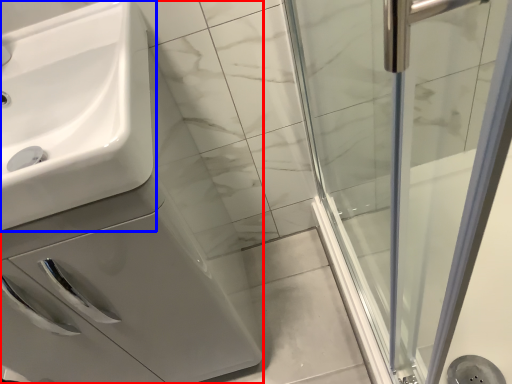
Question: Which of the following is the closest to the observer, porcelain (highlighted by a red box) or sink (highlighted by a blue box)?

Choices:
 (A) porcelain
 (B) sink

Answer: (B)